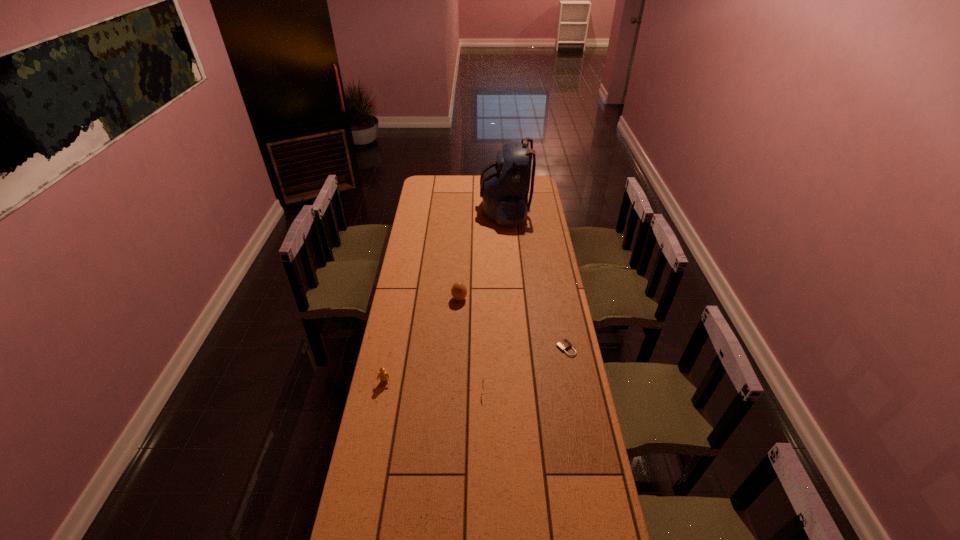
The width and height of the screenshot is (960, 540). In order to click on backpack present at the right edge in this screenshot , I will do `click(504, 184)`.

The image size is (960, 540). I want to click on padlock located at the right edge, so click(564, 344).

I want to click on object positioned at the far right corner, so click(x=504, y=184).

I want to click on free region at the left edge, so click(x=427, y=199).

The height and width of the screenshot is (540, 960). Identify the location of vacant region at the right edge of the desktop. (558, 292).

Where is `free space at the far left corner`? The image size is (960, 540). free space at the far left corner is located at coordinates (418, 189).

Where is `blank area at the far right corner`? blank area at the far right corner is located at coordinates (538, 178).

The image size is (960, 540). Identify the location of unoccupied position between the boiled egg and the third farthest object. (x=513, y=323).

Identify the location of unoccupied position between the leftmost object and the sunglasses. (437, 387).

Identify the location of free space that is in between the leftmost object and the third farthest object. (475, 366).